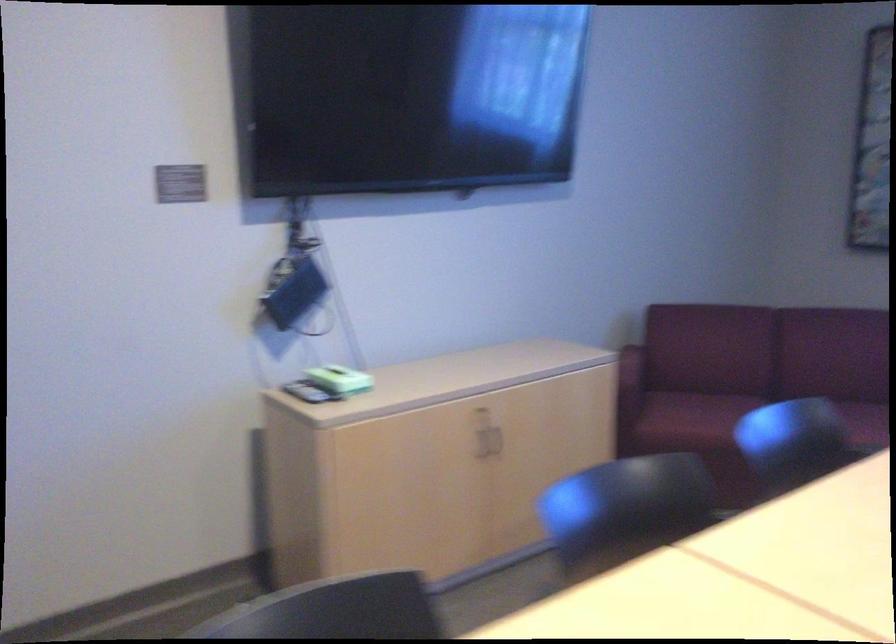
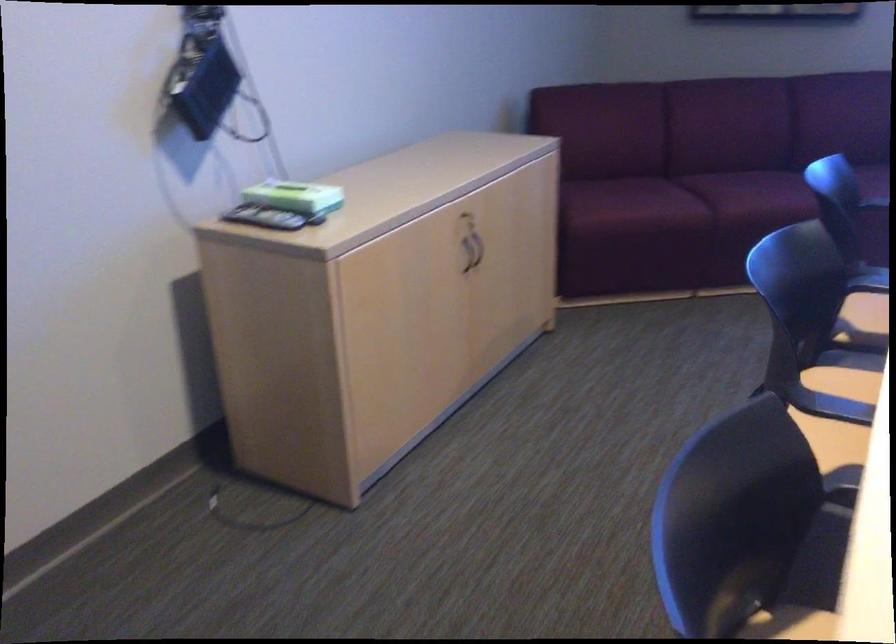
What movement of the cameraman would produce the second image?

The cameraman walked toward left, forward.